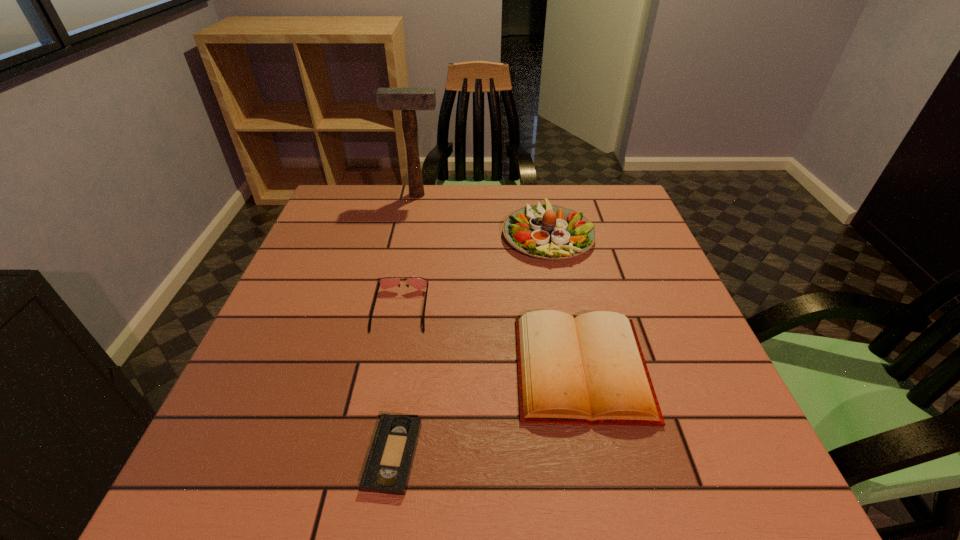
The width and height of the screenshot is (960, 540). Find the location of `the tallest object`. the tallest object is located at coordinates (408, 100).

This screenshot has height=540, width=960. Find the location of `mallet`. mallet is located at coordinates (408, 100).

Image resolution: width=960 pixels, height=540 pixels. Identify the location of the fourth shortest object. (546, 231).

Find the location of a particular element. This screenshot has width=960, height=540. salad plate is located at coordinates (546, 231).

Locate an element on the screen. sunglasses is located at coordinates (385, 282).

Identify the location of Bible. This screenshot has width=960, height=540. (590, 369).

Find the location of a particular element. The height and width of the screenshot is (540, 960). videotape is located at coordinates (389, 463).

Locate an element on the screen. The width and height of the screenshot is (960, 540). vacant region located on the left of the farthest object is located at coordinates (344, 194).

The width and height of the screenshot is (960, 540). Find the location of `free space located on the back of the second farthest object`. free space located on the back of the second farthest object is located at coordinates (539, 188).

The width and height of the screenshot is (960, 540). Identify the location of blank space located 0.320m on the bridge of the sunglasses. (368, 487).